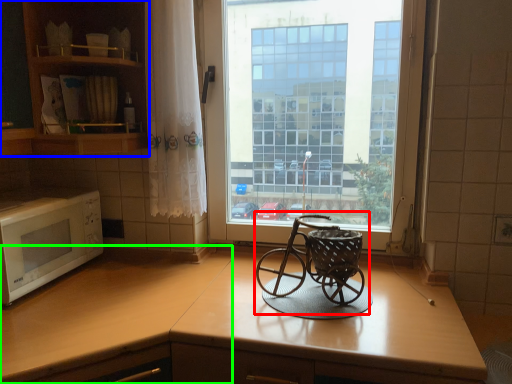
Question: Which is farther away from baby carriage (highlighted by a red box)? cabinetry (highlighted by a blue box) or counter top (highlighted by a green box)?

Choices:
 (A) cabinetry
 (B) counter top

Answer: (A)